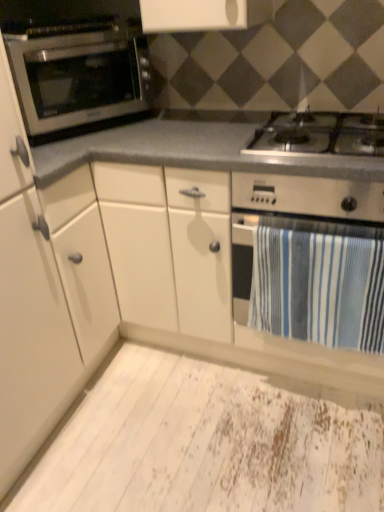
Question: Considering the relative positions of white matte cabinet at left and white distressed plywood at lower center in the image provided, is white matte cabinet at left to the left or to the right of white distressed plywood at lower center?

Choices:
 (A) right
 (B) left

Answer: (B)

Question: Looking at their shapes, would you say white matte cabinet at left is wider or thinner than white distressed plywood at lower center?

Choices:
 (A) wide
 (B) thin

Answer: (B)

Question: Which object is the closest to the blue striped towel at lower right?

Choices:
 (A) satin silver oven at left
 (B) white matte cabinet at left
 (C) stainless steel gas stove at center
 (D) white distressed plywood at lower center

Answer: (C)

Question: Based on their relative distances, which object is nearer to the satin silver oven at left?

Choices:
 (A) white distressed plywood at lower center
 (B) stainless steel gas stove at center
 (C) blue striped towel at lower right
 (D) white matte cabinet at left

Answer: (D)